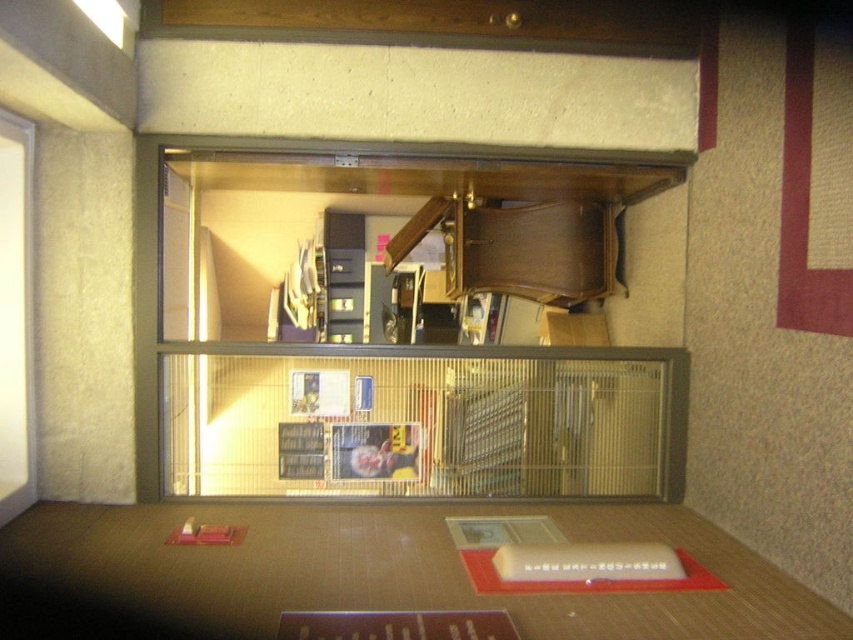
Who is positioned more to the right, metallic wire cage at center or wooden shelf at center?

From the viewer's perspective, wooden shelf at center appears more on the right side.

Between metallic wire cage at center and wooden shelf at center, which one is positioned lower?

wooden shelf at center

Does point (224, 244) lie in front of point (380, 348)?

No, (224, 244) is further to viewer.

Where is `metallic wire cage at center`? metallic wire cage at center is located at coordinates click(403, 324).

Measure the distance between wooden shelf at center and camera.

wooden shelf at center and camera are 10.18 feet apart from each other.

Is wooden shelf at center further to camera compared to wooden table at center?

Yes, it is.

What do you see at coordinates (428, 419) in the screenshot? The width and height of the screenshot is (853, 640). I see `wooden shelf at center` at bounding box center [428, 419].

You are a GUI agent. You are given a task and a screenshot of the screen. Output one action in this format:
    pyautogui.click(x=<x>, y=<y>)
    Task: Click on the wooden shelf at center
    Image resolution: width=853 pixels, height=640 pixels.
    Given the screenshot: What is the action you would take?
    pyautogui.click(x=428, y=419)

Can you confirm if metallic wire cage at center is shorter than wooden table at center?

In fact, metallic wire cage at center may be taller than wooden table at center.

Is metallic wire cage at center closer to the viewer compared to wooden table at center?

No, it is behind wooden table at center.

Is point (257, 435) more distant than point (764, 632)?

Yes, point (257, 435) is behind point (764, 632).

At what (x,y) coordinates should I click in order to perform the action: click on metallic wire cage at center. Please return your answer as a coordinate pair (x, y). The image size is (853, 640). Looking at the image, I should click on (403, 324).